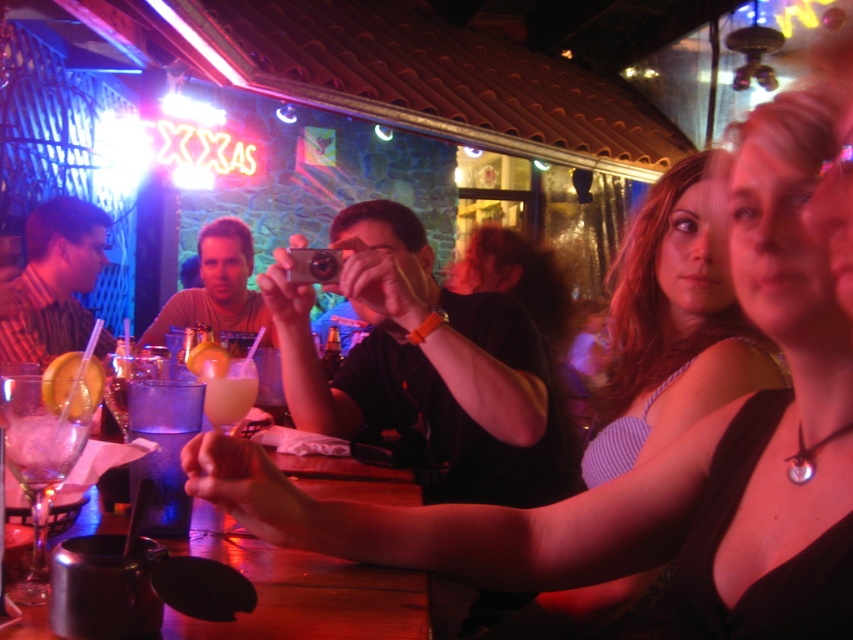
Question: Which point is farther to the camera?

Choices:
 (A) matte black camera at center
 (B) matte purple tank top at center
 (C) translucent glass cup at bar center

Answer: (A)

Question: Which point is closer to the camera?

Choices:
 (A) translucent glass drink at bar center
 (B) translucent glass cup at bar center
 (C) matte purple tank top at center
 (D) metallic silver cup at lower center

Answer: (D)

Question: Which object is closer to the camera taking this photo?

Choices:
 (A) translucent glass cup at bar center
 (B) matte brown shirt at center
 (C) matte black camera at center

Answer: (A)

Question: Can you confirm if matte black tank top at center is positioned to the right of matte purple tank top at center?

Choices:
 (A) no
 (B) yes

Answer: (A)

Question: Is the position of matte purple tank top at center more distant than that of metallic silver cup at lower center?

Choices:
 (A) no
 (B) yes

Answer: (B)

Question: Is matte black camera at center thinner than translucent glass drink at bar center?

Choices:
 (A) no
 (B) yes

Answer: (A)